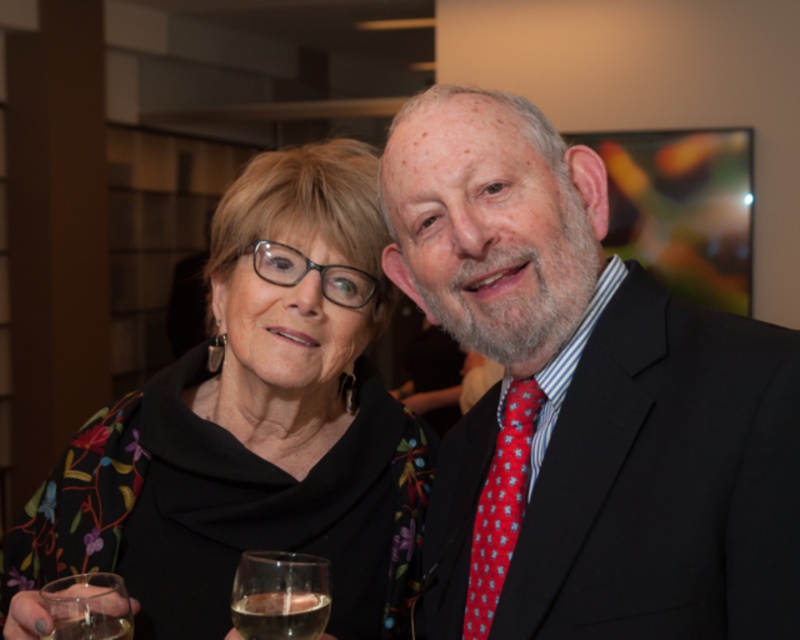
You are taking a photo of two people at an event. You notice two points in the image labeled as point 1 and point 2. If point 1 is at coordinate (393, 472) and point 2 is at (124, 595), which point is closer to the camera?

Point 1 at coordinate (393, 472) is closer to the camera than point 2 at (124, 595).

You are at a social event and see the clear glass wine glass at lower left. Where exactly is it located in the image?

The clear glass wine glass at lower left is located at point (280,595).

You are organizing a costume party and need to decide which accessory to place in a showcase. The showcase has a narrow shelf that can only accommodate items up to 2 centimeters in width. You have the red dotted fabric tie at right and the transparent glass at lower left. Which item would fit better on the shelf?

The red dotted fabric tie at right is thinner than the transparent glass at lower left, so it would fit better on the narrow shelf since it is thinner than the 2 centimeter width limit.